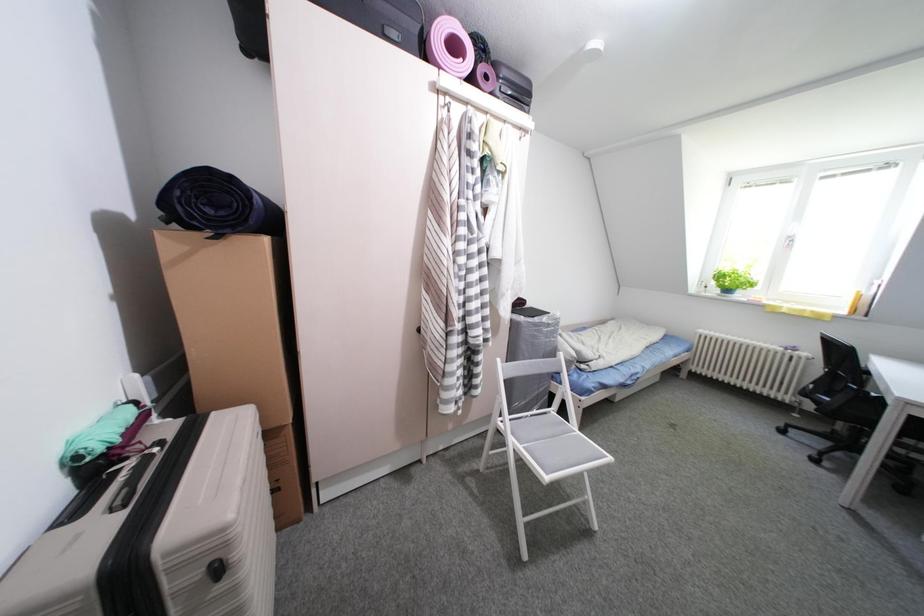
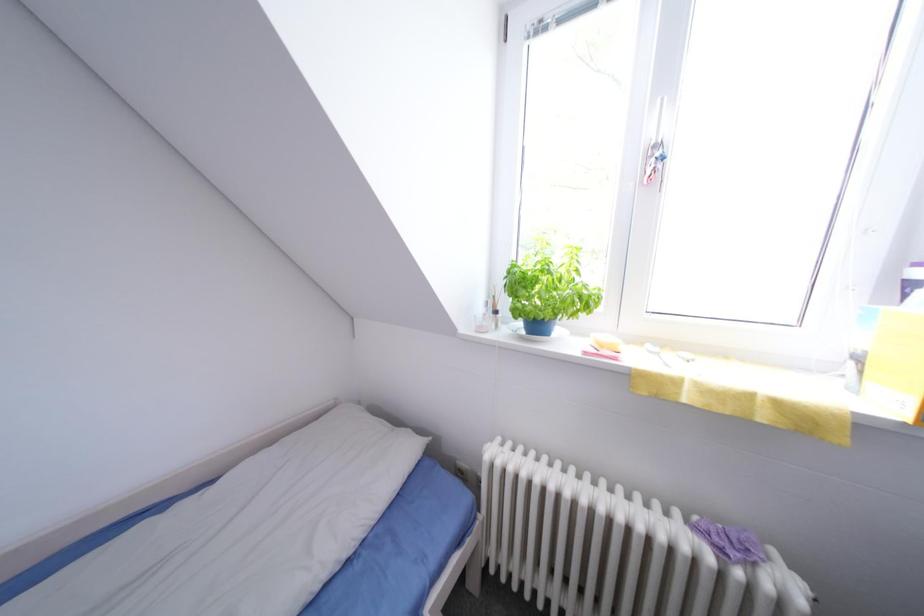
The images are taken continuously from a first-person perspective. In which direction are you moving?

The cameraman moved toward right, forward.